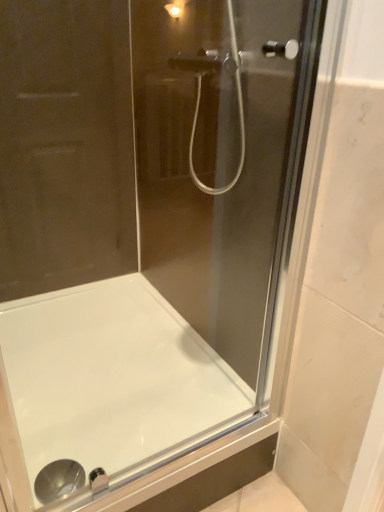
Measure the distance between point (168, 323) and camera.

Point (168, 323) is 1.63 meters away from camera.

What do you see at coordinates (110, 375) in the screenshot? I see `white glossy bathtub at center` at bounding box center [110, 375].

Locate an element on the screen. white glossy bathtub at center is located at coordinates (110, 375).

Locate an element on the screen. The height and width of the screenshot is (512, 384). white glossy bathtub at center is located at coordinates (110, 375).